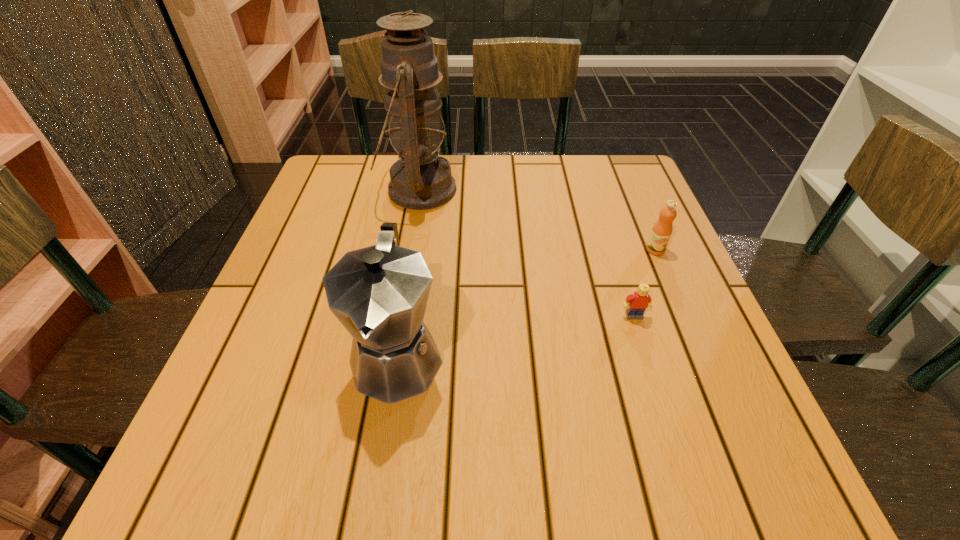
The width and height of the screenshot is (960, 540). Find the location of `vacant space at the near right corner of the desktop`. vacant space at the near right corner of the desktop is located at coordinates (770, 449).

Image resolution: width=960 pixels, height=540 pixels. I want to click on free space between the farthest object and the rightmost object, so click(x=537, y=220).

The height and width of the screenshot is (540, 960). Find the location of `free space between the third tallest object and the Lego`. free space between the third tallest object and the Lego is located at coordinates pyautogui.click(x=644, y=283).

The width and height of the screenshot is (960, 540). In order to click on blank region between the second farthest object and the coffeepot in this screenshot , I will do [526, 303].

Locate an element on the screen. This screenshot has height=540, width=960. vacant area that lies between the second shortest object and the third object from left to right is located at coordinates (644, 283).

At what (x,y) coordinates should I click in order to perform the action: click on free area in between the third nearest object and the shortest object. Please return your answer as a coordinate pair (x, y). This screenshot has height=540, width=960. Looking at the image, I should click on (644, 283).

Identify the location of free space between the coffeepot and the second shortest object. The width and height of the screenshot is (960, 540). (526, 303).

Locate an element on the screen. free spot between the orange juice and the Lego is located at coordinates (644, 283).

You are a GUI agent. You are given a task and a screenshot of the screen. Output one action in this format:
    pyautogui.click(x=<x>, y=<y>)
    Task: Click on the free space that is in between the second shortest object and the coffeepot
    
    Given the screenshot: What is the action you would take?
    pyautogui.click(x=526, y=303)

Locate an element on the screen. The image size is (960, 540). vacant point located between the farthest object and the rightmost object is located at coordinates (537, 220).